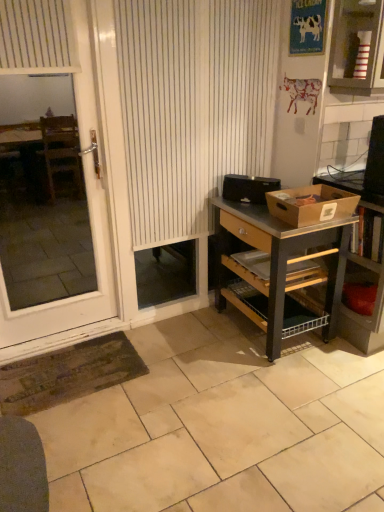
This screenshot has height=512, width=384. Find the location of `vacant space situated on the left part of wooden desk at right`. vacant space situated on the left part of wooden desk at right is located at coordinates (189, 343).